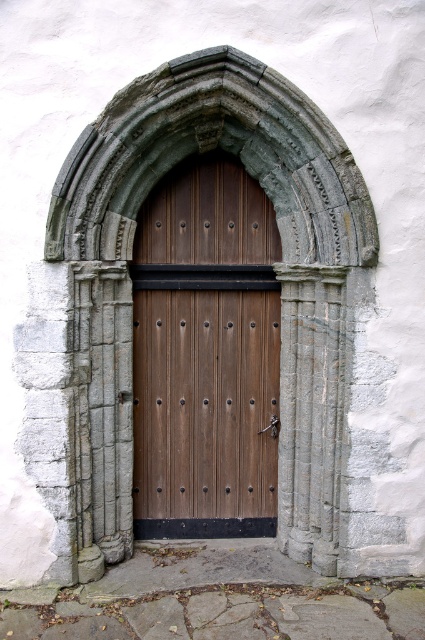
Question: Is wooden door at center thinner than gray stone archway at center?

Choices:
 (A) yes
 (B) no

Answer: (A)

Question: Which point appears closest to the camera in this image?

Choices:
 (A) (64, 228)
 (B) (266, 513)

Answer: (A)

Question: Can you confirm if wooden door at center is positioned to the right of gray stone archway at center?

Choices:
 (A) yes
 (B) no

Answer: (B)

Question: Does wooden door at center appear on the left side of gray stone archway at center?

Choices:
 (A) yes
 (B) no

Answer: (A)

Question: Which point appears closest to the camera in this image?

Choices:
 (A) 252,534
 (B) 201,120

Answer: (B)